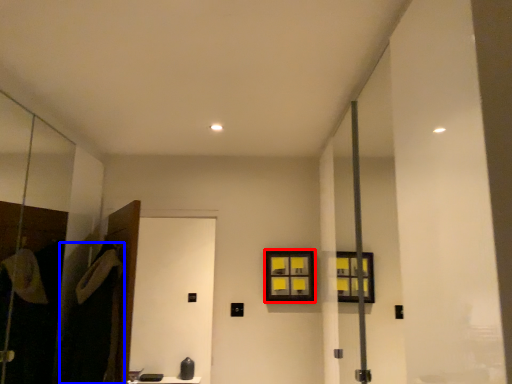
Question: Which point is further to the camera, window (highlighted by a red box) or robe (highlighted by a blue box)?

Choices:
 (A) window
 (B) robe

Answer: (A)